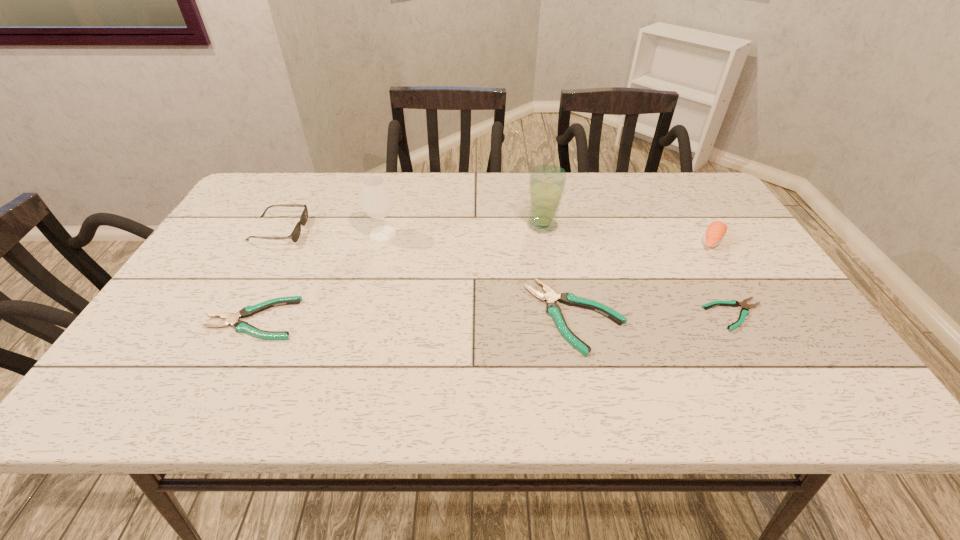
The image size is (960, 540). Find the location of `the second shortest object`. the second shortest object is located at coordinates (232, 319).

Locate an element on the screen. The width and height of the screenshot is (960, 540). the second shortest pliers is located at coordinates (232, 319).

You are a GUI agent. You are given a task and a screenshot of the screen. Output one action in this format:
    pyautogui.click(x=<x>, y=<y>)
    Task: Click on the second pliers from left to right
    This screenshot has height=540, width=960.
    Given the screenshot: What is the action you would take?
    pyautogui.click(x=551, y=297)

Locate an element on the screen. This screenshot has height=540, width=960. the shortest object is located at coordinates (744, 312).

Where is `the rightmost pliers`? the rightmost pliers is located at coordinates (744, 312).

You are a GUI agent. You are given a task and a screenshot of the screen. Output one action in this format:
    pyautogui.click(x=<x>, y=<y>)
    Task: Click on the third object from left to right
    This screenshot has width=960, height=540.
    Given the screenshot: What is the action you would take?
    pyautogui.click(x=377, y=203)

At what (x,y) coordinates should I click in order to perform the action: click on sunglasses. Please return your answer as a coordinate pair (x, y). The height and width of the screenshot is (540, 960). Looking at the image, I should click on (295, 234).

You are a GUI agent. You are given a task and a screenshot of the screen. Output one action in this format:
    pyautogui.click(x=<x>, y=<y>)
    Task: Click on the third tallest object
    The image size is (960, 540).
    Given the screenshot: What is the action you would take?
    pyautogui.click(x=715, y=232)

Identify the location of the right glass. (547, 182).

Identify the location of free space located 0.380m on the back of the sixth tallest object. (308, 208).